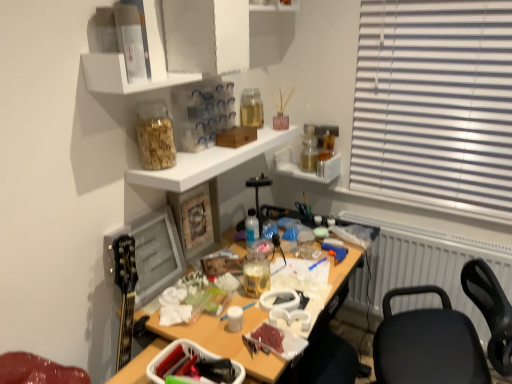
The height and width of the screenshot is (384, 512). What do you see at coordinates (251, 108) in the screenshot?
I see `translucent glass bottle at upper center, which is counted as the second bottle, starting from the left` at bounding box center [251, 108].

Describe the element at coordinates (302, 170) in the screenshot. I see `translucent glass jars at upper right, arranged as the 4th shelf when viewed from the top` at that location.

This screenshot has height=384, width=512. What do you see at coordinates (273, 6) in the screenshot?
I see `clear plastic container at upper center, the 4th shelf from the bottom` at bounding box center [273, 6].

The image size is (512, 384). I want to click on white glossy shelf at upper center, which is the second shelf in bottom-to-top order, so click(209, 162).

The image size is (512, 384). Describe the element at coordinates (309, 154) in the screenshot. I see `translucent glass jar at upper right, which is the 1th bottle in right-to-left order` at that location.

Find the location of a particular element. The width and height of the screenshot is (512, 384). white plastic radiator at right is located at coordinates (428, 264).

Consider the image. Could you tell me if white glossy shelf at upper center, which is the second shelf in bottom-to-top order, is facing translucent glass bottle at upper center, arranged as the 3th bottle when viewed from the front?

No, white glossy shelf at upper center, which is the second shelf in bottom-to-top order, is not oriented towards translucent glass bottle at upper center, arranged as the 3th bottle when viewed from the front.

Considering the relative positions of white glossy shelf at upper center, which is the second shelf in bottom-to-top order, and translucent glass bottle at upper center, arranged as the 3th bottle when viewed from the front, in the image provided, is white glossy shelf at upper center, which is the second shelf in bottom-to-top order, to the left of translucent glass bottle at upper center, arranged as the 3th bottle when viewed from the front, from the viewer's perspective?

Yes, white glossy shelf at upper center, which is the second shelf in bottom-to-top order, is to the left of translucent glass bottle at upper center, arranged as the 3th bottle when viewed from the front.

How many degrees apart are the facing directions of white glossy shelf at upper center, the 3th shelf when ordered from top to bottom, and translucent plastic bottle at center, acting as the 2th bottle starting from the front?

There is a 4.09-degree angle between the facing directions of white glossy shelf at upper center, the 3th shelf when ordered from top to bottom, and translucent plastic bottle at center, acting as the 2th bottle starting from the front.

Measure the distance from white glossy shelf at upper center, which is the second shelf in bottom-to-top order, to translucent plastic bottle at center, placed as the fourth bottle when sorted from top to bottom.

white glossy shelf at upper center, which is the second shelf in bottom-to-top order, and translucent plastic bottle at center, placed as the fourth bottle when sorted from top to bottom, are 16.96 inches apart from each other.

Would you say white glossy shelf at upper center, the 3th shelf when ordered from top to bottom, is inside or outside translucent plastic bottle at center, positioned as the 3th bottle in left-to-right order?

white glossy shelf at upper center, the 3th shelf when ordered from top to bottom, lies outside translucent plastic bottle at center, positioned as the 3th bottle in left-to-right order.

Who is taller, white glossy shelf at upper center, the 3th shelf when ordered from top to bottom, or translucent plastic bottle at center, positioned as the second bottle in right-to-left order?

translucent plastic bottle at center, positioned as the second bottle in right-to-left order, is taller.

Is translucent glass jar at upper center, which is the third bottle in top-to-bottom order, at the right side of translucent glass jar at upper right, the third bottle positioned from the bottom?

No.

Is translucent glass jar at upper center, which is the third bottle in top-to-bottom order, taller or shorter than translucent glass jar at upper right, the second bottle from the top?

Considering their sizes, translucent glass jar at upper center, which is the third bottle in top-to-bottom order, has more height than translucent glass jar at upper right, the second bottle from the top.

From a real-world perspective, is translucent glass jar at upper center, which is the third bottle in top-to-bottom order, located higher than translucent glass jar at upper right, the 4th bottle when ordered from front to back?

Yes.

From the image's perspective, relative to translucent glass jar at upper right, the third bottle positioned from the bottom, is translucent glass jar at upper center, the 4th bottle from the back, above or below?

Based on their image positions, translucent glass jar at upper center, the 4th bottle from the back, is located beneath translucent glass jar at upper right, the third bottle positioned from the bottom.

Considering the positions of point (249, 123) and point (306, 135), is point (249, 123) closer or farther from the camera than point (306, 135)?

Point (249, 123) is closer to the camera than point (306, 135).

Looking at this image, from a real-world perspective, is translucent glass bottle at upper center, the 2th bottle from the back, physically below translucent glass jar at upper right, the second bottle from the top?

Incorrect, from a real-world perspective, translucent glass bottle at upper center, the 2th bottle from the back, is higher than translucent glass jar at upper right, the second bottle from the top.

Which object is positioned more to the left, translucent glass bottle at upper center, which ranks as the 1th bottle in top-to-bottom order, or translucent glass jar at upper right, the 4th bottle from the left?

From the viewer's perspective, translucent glass bottle at upper center, which ranks as the 1th bottle in top-to-bottom order, appears more on the left side.

Based on their sizes in the image, would you say translucent glass bottle at upper center, which ranks as the 1th bottle in top-to-bottom order, is bigger or smaller than translucent glass jar at upper center, which is the third bottle in top-to-bottom order?

In the image, translucent glass bottle at upper center, which ranks as the 1th bottle in top-to-bottom order, appears to be smaller than translucent glass jar at upper center, which is the third bottle in top-to-bottom order.

Identify the location of bottle that is the 1st one below the translucent glass jar at upper center, which is counted as the first bottle, starting from the front (from a real-world perspective). The height and width of the screenshot is (384, 512). (251, 108).

Considering the sizes of objects translucent glass bottle at upper center, which is the 4th bottle from bottom to top, and translucent glass jar at upper center, which is the third bottle in top-to-bottom order, in the image provided, who is thinner, translucent glass bottle at upper center, which is the 4th bottle from bottom to top, or translucent glass jar at upper center, which is the third bottle in top-to-bottom order,?

Thinner between the two is translucent glass bottle at upper center, which is the 4th bottle from bottom to top.

Is translucent glass bottle at upper center, arranged as the 3th bottle when viewed from the front, in front of or behind translucent glass jar at upper center, which appears as the first bottle when viewed from the left, in the image?

Visually, translucent glass bottle at upper center, arranged as the 3th bottle when viewed from the front, is located behind translucent glass jar at upper center, which appears as the first bottle when viewed from the left.

From a real-world perspective, is clear plastic container at upper center, arranged as the first shelf when viewed from the top, positioned above or below translucent glass jar at upper right, the third bottle positioned from the bottom?

From a real-world perspective, clear plastic container at upper center, arranged as the first shelf when viewed from the top, is physically above translucent glass jar at upper right, the third bottle positioned from the bottom.

Considering the sizes of clear plastic container at upper center, arranged as the first shelf when viewed from the top, and translucent glass jar at upper right, which is the 1th bottle in right-to-left order, in the image, is clear plastic container at upper center, arranged as the first shelf when viewed from the top, taller or shorter than translucent glass jar at upper right, which is the 1th bottle in right-to-left order,?

Considering their sizes, clear plastic container at upper center, arranged as the first shelf when viewed from the top, has more height than translucent glass jar at upper right, which is the 1th bottle in right-to-left order.

Is clear plastic container at upper center, arranged as the first shelf when viewed from the top, facing away from translucent glass jar at upper right, the second bottle from the top?

No, clear plastic container at upper center, arranged as the first shelf when viewed from the top, is not facing the opposite direction of translucent glass jar at upper right, the second bottle from the top.

Are clear plastic container at upper center, the 4th shelf from the bottom, and translucent glass jar at upper right, positioned as the 1th bottle in back-to-front order, making contact?

clear plastic container at upper center, the 4th shelf from the bottom, is not next to translucent glass jar at upper right, positioned as the 1th bottle in back-to-front order, and they're not touching.

From the image's perspective, between translucent glass jar at upper right, which is the 1th bottle in right-to-left order, and white plastic radiator at right, who is located below?

white plastic radiator at right appears lower in the image.

What's the angular difference between translucent glass jar at upper right, the second bottle from the top, and white plastic radiator at right's facing directions?

The angular difference between translucent glass jar at upper right, the second bottle from the top, and white plastic radiator at right is 2.31 degrees.

Considering the sizes of objects translucent glass jar at upper right, positioned as the 1th bottle in back-to-front order, and white plastic radiator at right in the image provided, who is wider, translucent glass jar at upper right, positioned as the 1th bottle in back-to-front order, or white plastic radiator at right?

Wider between the two is white plastic radiator at right.

You are a GUI agent. You are given a task and a screenshot of the screen. Output one action in this format:
    pyautogui.click(x=<x>, y=<y>)
    Task: Click on the 1st bottle to the left when counting from the white plastic radiator at right
    
    Given the screenshot: What is the action you would take?
    pyautogui.click(x=309, y=154)

Where is `the 2nd shelf in front of the translucent glass bottle at upper center, arranged as the 3th bottle when viewed from the front`? Image resolution: width=512 pixels, height=384 pixels. the 2nd shelf in front of the translucent glass bottle at upper center, arranged as the 3th bottle when viewed from the front is located at coordinates (209, 162).

There is a white glossy shelf at upper center, which is the second shelf in bottom-to-top order. In order to click on the 2nd bottle below it (from a real-world perspective) in this screenshot , I will do `click(251, 228)`.

Which object lies further to the anchor point clear plastic container at upper center, arranged as the first shelf when viewed from the top, translucent glass jar at upper center, the 4th bottle positioned from the right, or white glossy shelf at upper center, acting as the 2th shelf starting from the top?

translucent glass jar at upper center, the 4th bottle positioned from the right, is further to clear plastic container at upper center, arranged as the first shelf when viewed from the top.

Which object lies nearer to the anchor point translucent glass bottle at upper center, which is the 3th bottle in right-to-left order, white glossy shelf at upper center, positioned as the third shelf in bottom-to-top order, or translucent glass jars at upper right, which is counted as the 1th shelf, starting from the bottom?

Among the two, translucent glass jars at upper right, which is counted as the 1th shelf, starting from the bottom, is located nearer to translucent glass bottle at upper center, which is the 3th bottle in right-to-left order.

Considering their positions, is translucent glass jar at upper center, which appears as the first bottle when viewed from the left, positioned closer to translucent glass jar at upper right, which is the 1th bottle in right-to-left order, than translucent glass jars at upper right, arranged as the 4th shelf when viewed from the top?

The object closer to translucent glass jar at upper right, which is the 1th bottle in right-to-left order, is translucent glass jars at upper right, arranged as the 4th shelf when viewed from the top.

Estimate the real-world distances between objects in this image. Which object is further from translucent glass bottle at upper center, which is counted as the second bottle, starting from the left, translucent glass jar at upper right, the second bottle from the top, or white glossy shelf at upper center, positioned as the third shelf in bottom-to-top order?

white glossy shelf at upper center, positioned as the third shelf in bottom-to-top order.

Consider the image. Looking at the image, which one is located further to translucent glass jar at upper center, which is counted as the first bottle, starting from the front, translucent glass jar at upper right, which is the 1th bottle in right-to-left order, or translucent plastic bottle at center, positioned as the second bottle in right-to-left order?

Among the two, translucent glass jar at upper right, which is the 1th bottle in right-to-left order, is located further to translucent glass jar at upper center, which is counted as the first bottle, starting from the front.

From the image, which object appears to be nearer to translucent glass bottle at upper center, the 2th bottle from the back, white glossy shelf at upper center, which is the second shelf in bottom-to-top order, or translucent glass jar at upper center, the 2th bottle from the bottom?

white glossy shelf at upper center, which is the second shelf in bottom-to-top order, is positioned closer to the anchor translucent glass bottle at upper center, the 2th bottle from the back.

Estimate the real-world distances between objects in this image. Which object is further from white glossy shelf at upper center, which is the second shelf in bottom-to-top order, white plastic radiator at right or clear plastic container at upper center, arranged as the first shelf when viewed from the top?

white plastic radiator at right is positioned further to the anchor white glossy shelf at upper center, which is the second shelf in bottom-to-top order.

Based on their spatial positions, is white glossy shelf at upper center, which is the second shelf in bottom-to-top order, or translucent glass jars at upper right, arranged as the 4th shelf when viewed from the top, further from translucent glass jar at upper right, positioned as the 1th bottle in back-to-front order?

white glossy shelf at upper center, which is the second shelf in bottom-to-top order, is positioned further to the anchor translucent glass jar at upper right, positioned as the 1th bottle in back-to-front order.

Find the location of a particular element. bottle between white glossy shelf at upper center, acting as the 2th shelf starting from the top, and translucent plastic bottle at center, acting as the 2th bottle starting from the front, from front to back is located at coordinates (155, 136).

I want to click on bottle located between white glossy shelf at upper center, which is the second shelf in bottom-to-top order, and translucent plastic bottle at center, which is the third bottle from back to front, in the depth direction, so click(155, 136).

Identify the location of bottle between translucent plastic bottle at center, positioned as the 3th bottle in left-to-right order, and white plastic radiator at right. Image resolution: width=512 pixels, height=384 pixels. (309, 154).

Identify the location of shelf between clear plastic container at upper center, arranged as the first shelf when viewed from the top, and translucent glass jar at upper center, which is the third bottle in top-to-bottom order, in the vertical direction. The width and height of the screenshot is (512, 384). (125, 76).